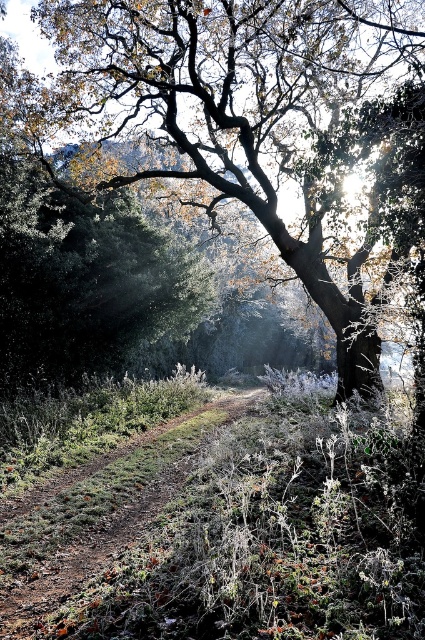
The width and height of the screenshot is (425, 640). Describe the element at coordinates (258, 131) in the screenshot. I see `smooth brown tree trunk at center` at that location.

Can you confirm if smooth brown tree trunk at center is shorter than brown dirt path at center?

No, smooth brown tree trunk at center is not shorter than brown dirt path at center.

Find the location of a particular element. smooth brown tree trunk at center is located at coordinates (258, 131).